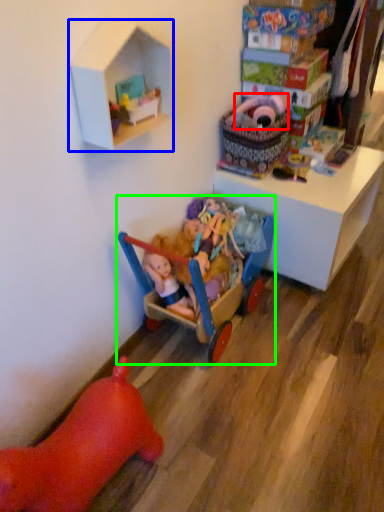
Question: Which object is the closest to the toy (highlighted by a red box)? Choose among these: shelf (highlighted by a blue box) or toy (highlighted by a green box).

Choices:
 (A) shelf
 (B) toy

Answer: (B)